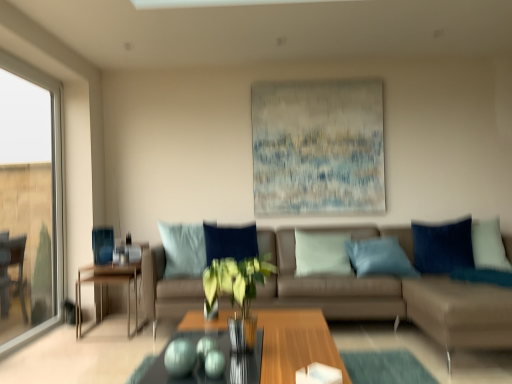
You are a GUI agent. You are given a task and a screenshot of the screen. Output one action in this format:
    pyautogui.click(x=<x>, y=<y>)
    Task: Click on the free region under textured canvas painting at upper center (from a real-world perspective)
    The width and height of the screenshot is (512, 384).
    Given the screenshot: What is the action you would take?
    pyautogui.click(x=309, y=222)